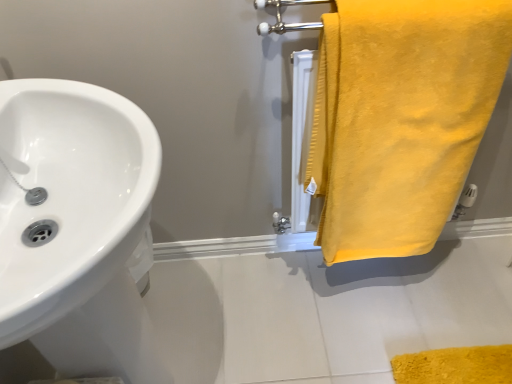
Question: Does point (458, 112) appear closer or farther from the camera than point (8, 132)?

Choices:
 (A) closer
 (B) farther

Answer: (B)

Question: Is yellow soft towel at right wider or thinner than white glossy sink at left?

Choices:
 (A) wide
 (B) thin

Answer: (B)

Question: Is yellow soft towel at right inside or outside of white glossy sink at left?

Choices:
 (A) inside
 (B) outside

Answer: (B)

Question: Considering the relative positions of white glossy sink at left and yellow soft towel at right in the image provided, is white glossy sink at left to the left or to the right of yellow soft towel at right?

Choices:
 (A) left
 (B) right

Answer: (A)

Question: Is white glossy sink at left in front of or behind yellow soft towel at right in the image?

Choices:
 (A) front
 (B) behind

Answer: (A)

Question: From their relative heights in the image, would you say white glossy sink at left is taller or shorter than yellow soft towel at right?

Choices:
 (A) tall
 (B) short

Answer: (A)

Question: Is point (72, 82) closer or farther from the camera than point (494, 21)?

Choices:
 (A) closer
 (B) farther

Answer: (A)